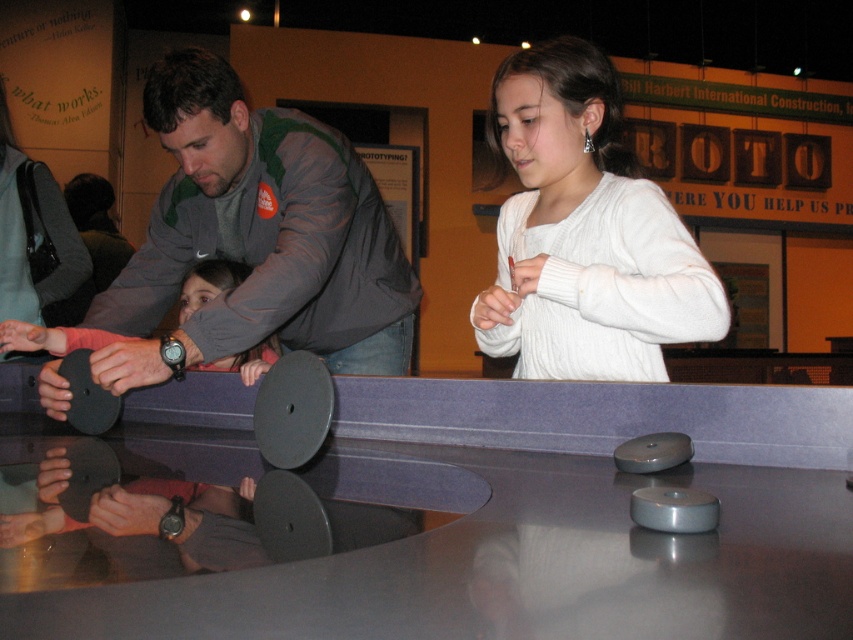
Between metallic gray table at center and gray/green jacket at upper left, which one appears on the left side from the viewer's perspective?

gray/green jacket at upper left

Between metallic gray table at center and gray/green jacket at upper left, which one has less height?

metallic gray table at center is shorter.

Is point (434, 625) positioned in front of point (403, 364)?

Yes.

Identify the location of metallic gray table at center. (534, 524).

Can you confirm if gray/green jacket at upper left is wider than black rubber table tennis table at lower left?

Yes, gray/green jacket at upper left is wider than black rubber table tennis table at lower left.

Is gray/green jacket at upper left bigger than black rubber table tennis table at lower left?

Indeed, gray/green jacket at upper left has a larger size compared to black rubber table tennis table at lower left.

Is point (163, 216) in front of point (77, 356)?

No.

At what (x,y) coordinates should I click in order to perform the action: click on gray/green jacket at upper left. Please return your answer as a coordinate pair (x, y). This screenshot has width=853, height=640. Looking at the image, I should click on (264, 230).

Measure the distance from metallic gray table at center to white knitted sweater at upper center.

They are 12.93 inches apart.

Is point (136, 600) behind point (575, 356)?

No, (136, 600) is closer to viewer.

Which is behind, point (560, 429) or point (583, 224)?

The point (583, 224) is behind.

This screenshot has width=853, height=640. In order to click on metallic gray table at center in this screenshot , I will do `click(534, 524)`.